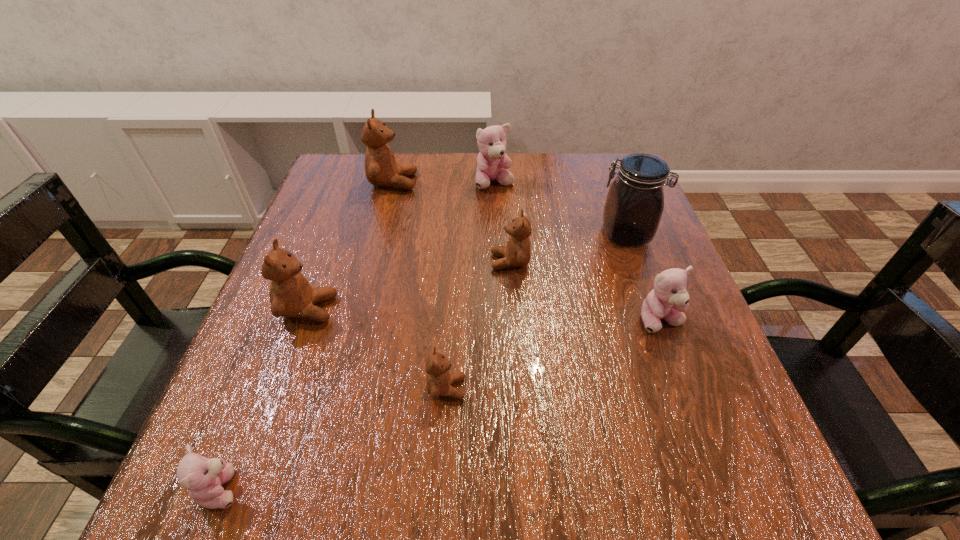
At what (x,y) coordinates should I click in order to perform the action: click on pink teddy bear that stands as the closest to the rightmost teddy bear. Please return your answer as a coordinate pair (x, y). This screenshot has width=960, height=540. Looking at the image, I should click on (492, 141).

This screenshot has height=540, width=960. Find the location of `the second closest pink teddy bear to the farthest brown teddy bear`. the second closest pink teddy bear to the farthest brown teddy bear is located at coordinates (668, 300).